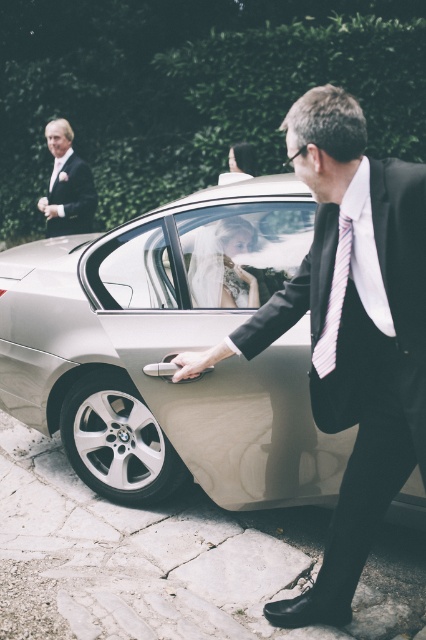
Question: Can you confirm if matte black suit at center is smaller than white striped tie at right?

Choices:
 (A) no
 (B) yes

Answer: (A)

Question: Is matte black suit at center above matte black suit at upper left?

Choices:
 (A) yes
 (B) no

Answer: (B)

Question: Is matte black suit at center below white striped tie at right?

Choices:
 (A) yes
 (B) no

Answer: (A)

Question: Among these points, which one is nearest to the camera?

Choices:
 (A) (348, 244)
 (B) (302, 220)

Answer: (A)

Question: Among these objects, which one is nearest to the camera?

Choices:
 (A) silver metallic car at center
 (B) matte black suit at upper left
 (C) white striped tie at right
 (D) matte black suit at center

Answer: (D)

Question: Which point is farther to the camera?

Choices:
 (A) (339, 273)
 (B) (34, 317)
 (C) (57, 138)

Answer: (C)